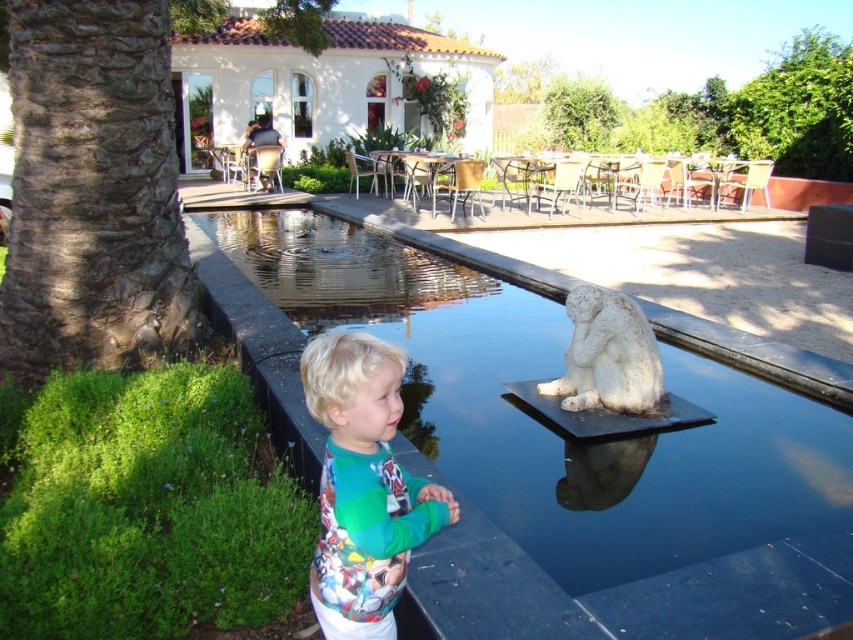
Question: Which object is farther from the camera taking this photo?

Choices:
 (A) smooth concrete pool at center
 (B) white stone statue at center
 (C) multicolored fleece sweater at lower left

Answer: (B)

Question: Can you confirm if smooth concrete pool at center is smaller than white stone statue at center?

Choices:
 (A) no
 (B) yes

Answer: (B)

Question: Among these objects, which one is nearest to the camera?

Choices:
 (A) smooth concrete pool at center
 (B) multicolored fleece sweater at lower left

Answer: (B)

Question: Can you confirm if smooth concrete pool at center is positioned to the left of multicolored fleece sweater at lower left?

Choices:
 (A) yes
 (B) no

Answer: (A)

Question: Does multicolored fleece sweater at lower left come in front of white stone statue at center?

Choices:
 (A) yes
 (B) no

Answer: (A)

Question: Which point appears farthest from the camera in this image?

Choices:
 (A) (627, 413)
 (B) (347, 452)
 (C) (793, 609)

Answer: (A)